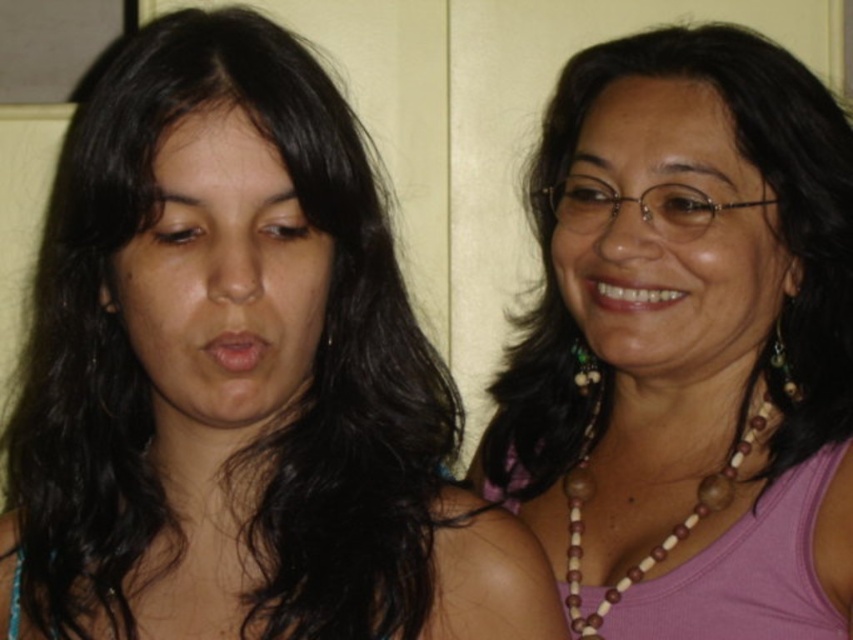
Question: Which point appears closest to the camera in this image?

Choices:
 (A) (35, 394)
 (B) (639, 298)

Answer: (B)

Question: Is brown wood beads at right above white glossy teeth at center?

Choices:
 (A) yes
 (B) no

Answer: (B)

Question: Which point is closer to the camera?

Choices:
 (A) (387, 433)
 (B) (643, 385)

Answer: (A)

Question: Does dark brown hair at left appear under brown wood beads at right?

Choices:
 (A) no
 (B) yes

Answer: (A)

Question: Which of the following is the closest to the observer?

Choices:
 (A) pink beaded necklace at upper right
 (B) dark brown hair at left
 (C) brown wood beads at right
 (D) matte skin face at left

Answer: (B)

Question: Does brown wooden necklace at upper right come behind white glossy teeth at center?

Choices:
 (A) yes
 (B) no

Answer: (B)